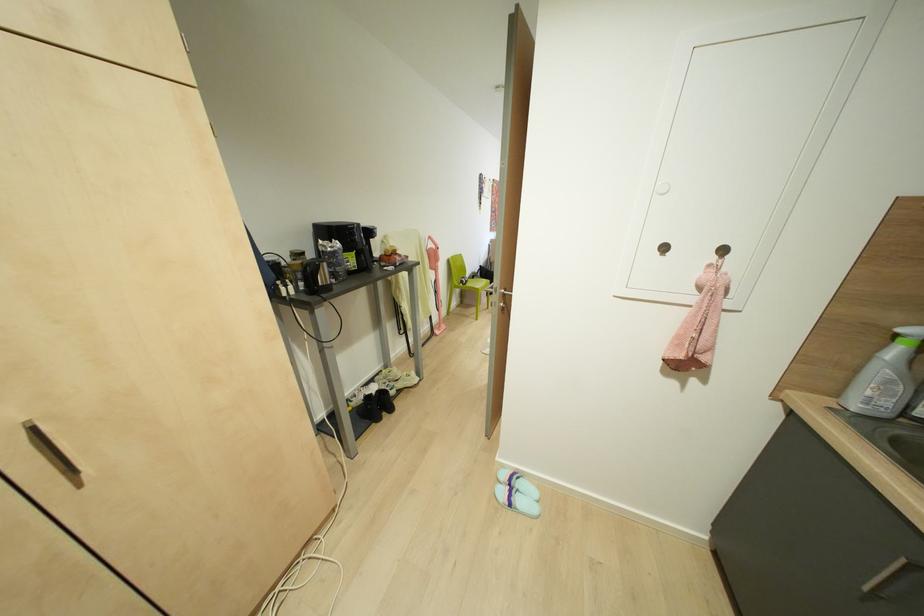
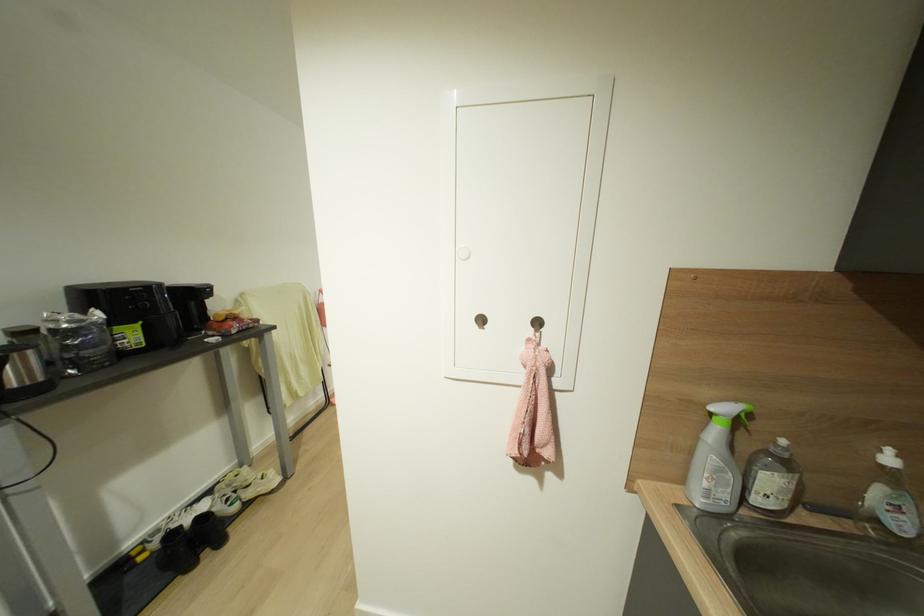
Question: I am providing you with two images of the same scene from different viewpoints. After the viewpoint changes to image2, which objects are now occluded?

Choices:
 (A) white cabinet knob
 (B) black cleaning brush
 (C) white bottle pump
 (D) none of these

Answer: (D)